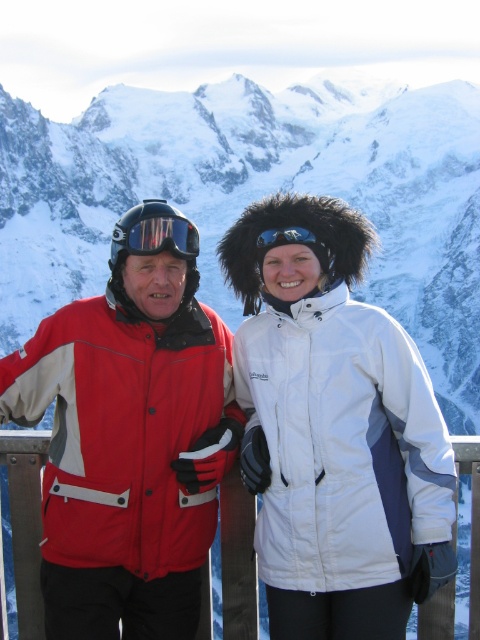
Is matte red jacket at center smaller than blue reflective goggles at center?

No, matte red jacket at center is not smaller than blue reflective goggles at center.

Is matte red jacket at center positioned in front of blue reflective goggles at center?

Yes, it is in front of blue reflective goggles at center.

You are a GUI agent. You are given a task and a screenshot of the screen. Output one action in this format:
    pyautogui.click(x=<x>, y=<y>)
    Task: Click on the matte red jacket at center
    The width and height of the screenshot is (480, 640).
    Given the screenshot: What is the action you would take?
    pyautogui.click(x=335, y=432)

Which is above, matte black goggles at upper left or blue reflective goggles at center?

matte black goggles at upper left

Can you confirm if matte black goggles at upper left is smaller than blue reflective goggles at center?

No, matte black goggles at upper left is not smaller than blue reflective goggles at center.

What do you see at coordinates (154, 230) in the screenshot? This screenshot has height=640, width=480. I see `matte black goggles at upper left` at bounding box center [154, 230].

Where is `matte black goggles at upper left`? The height and width of the screenshot is (640, 480). matte black goggles at upper left is located at coordinates (154, 230).

Can you confirm if snowy mountain at center is shorter than matte red jacket at center?

Incorrect, snowy mountain at center's height does not fall short of matte red jacket at center's.

Does snowy mountain at center have a greater height compared to matte red jacket at center?

Correct, snowy mountain at center is much taller as matte red jacket at center.

Measure the distance between point (342,140) and camera.

Point (342,140) and camera are 645.05 feet apart from each other.

You are a GUI agent. You are given a task and a screenshot of the screen. Output one action in this format:
    pyautogui.click(x=<x>, y=<y>)
    Task: Click on the snowy mountain at center
    This screenshot has height=640, width=480.
    Given the screenshot: What is the action you would take?
    pyautogui.click(x=256, y=196)